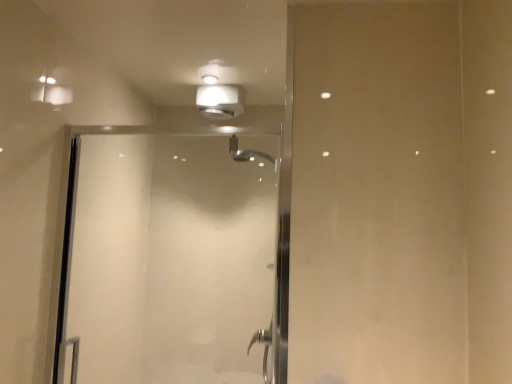
Question: Is transparent glass shower door at center wider than matte white light fixture at upper center?

Choices:
 (A) no
 (B) yes

Answer: (A)

Question: Is transparent glass shower door at center at the right side of matte white light fixture at upper center?

Choices:
 (A) yes
 (B) no

Answer: (B)

Question: Is transparent glass shower door at center with matte white light fixture at upper center?

Choices:
 (A) yes
 (B) no

Answer: (B)

Question: From a real-world perspective, is transparent glass shower door at center over matte white light fixture at upper center?

Choices:
 (A) no
 (B) yes

Answer: (A)

Question: From the image's perspective, does transparent glass shower door at center appear lower than matte white light fixture at upper center?

Choices:
 (A) no
 (B) yes

Answer: (B)

Question: Considering the relative positions of transparent glass shower door at center and matte white light fixture at upper center in the image provided, is transparent glass shower door at center to the left of matte white light fixture at upper center from the viewer's perspective?

Choices:
 (A) no
 (B) yes

Answer: (B)

Question: Does matte white light fixture at upper center turn towards transparent glass shower door at center?

Choices:
 (A) yes
 (B) no

Answer: (B)

Question: From a real-world perspective, is matte white light fixture at upper center on transparent glass shower door at center?

Choices:
 (A) yes
 (B) no

Answer: (A)

Question: Is matte white light fixture at upper center facing away from transparent glass shower door at center?

Choices:
 (A) yes
 (B) no

Answer: (B)

Question: Does matte white light fixture at upper center lie in front of transparent glass shower door at center?

Choices:
 (A) yes
 (B) no

Answer: (B)

Question: From a real-world perspective, is matte white light fixture at upper center beneath transparent glass shower door at center?

Choices:
 (A) yes
 (B) no

Answer: (B)

Question: Is the position of matte white light fixture at upper center more distant than that of transparent glass shower door at center?

Choices:
 (A) no
 (B) yes

Answer: (B)

Question: In the image, is matte white light fixture at upper center positioned in front of or behind transparent glass shower door at center?

Choices:
 (A) front
 (B) behind

Answer: (B)